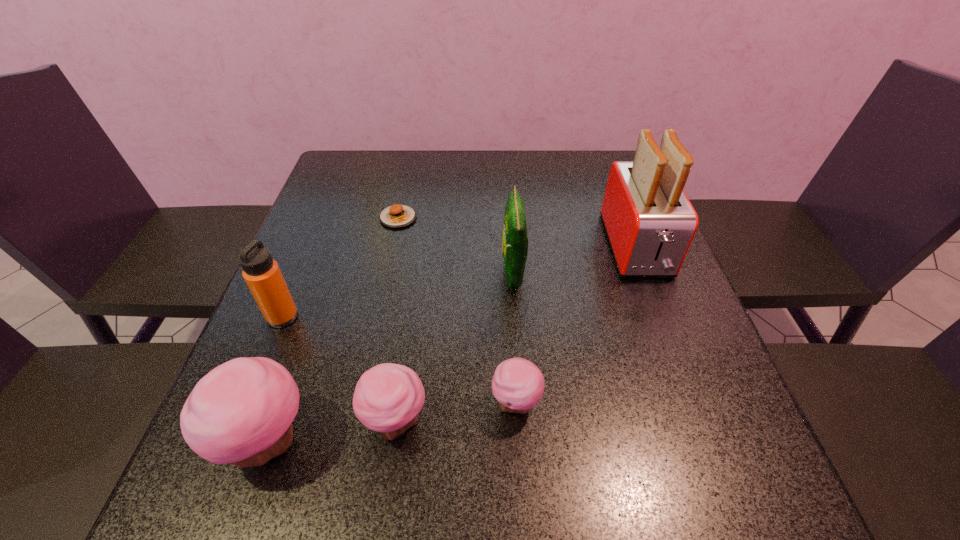
Identify the location of free space that is in between the crisp (potato chip) and the rightmost cupcake. This screenshot has height=540, width=960. point(515,339).

This screenshot has height=540, width=960. In order to click on free space between the rightmost object and the third shortest object in this screenshot , I will do `click(516, 334)`.

I want to click on vacant space in between the leftmost cupcake and the shortest object, so click(x=333, y=329).

Where is `free spot between the leftmost cupcake and the second cupcake from left to right`? free spot between the leftmost cupcake and the second cupcake from left to right is located at coordinates (331, 431).

You are a GUI agent. You are given a task and a screenshot of the screen. Output one action in this format:
    pyautogui.click(x=<x>, y=<y>)
    Task: Click on the free area in between the crisp (potato chip) and the thermos bottle
    The image size is (960, 540).
    Given the screenshot: What is the action you would take?
    pyautogui.click(x=397, y=295)

The image size is (960, 540). I want to click on free space that is in between the rightmost cupcake and the second tallest cupcake, so click(456, 413).

Image resolution: width=960 pixels, height=540 pixels. In order to click on vacant space that's between the crisp (potato chip) and the thermos bottle in this screenshot , I will do click(x=397, y=295).

Select which object appears as the fifth closest to the crisp (potato chip). Please provide its 2D coordinates. Your answer should be formatted as a tuple, i.e. [(x, y)], where the tuple contains the x and y coordinates of a point satisfying the conditions above.

[(241, 412)]

Where is `object that stands as the sixth closest to the crisp (potato chip)`? This screenshot has width=960, height=540. object that stands as the sixth closest to the crisp (potato chip) is located at coordinates (261, 272).

You are a GUI agent. You are given a task and a screenshot of the screen. Output one action in this format:
    pyautogui.click(x=<x>, y=<y>)
    Task: Click on the third closest cupcake relative to the fourth nearest object
    The width and height of the screenshot is (960, 540).
    Given the screenshot: What is the action you would take?
    pyautogui.click(x=518, y=385)